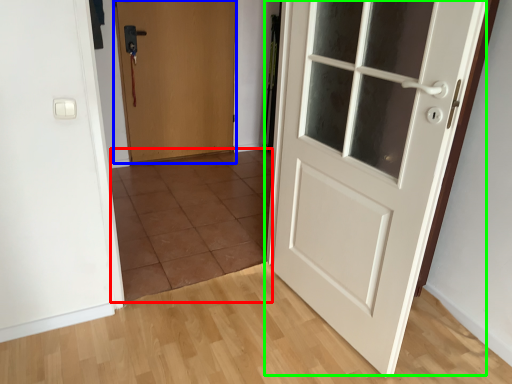
Question: Considering the real-world distances, which object is farthest from tile (highlighted by a red box)? door (highlighted by a blue box) or door (highlighted by a green box)?

Choices:
 (A) door
 (B) door

Answer: (B)